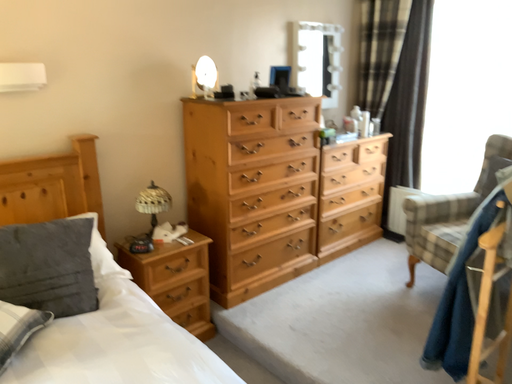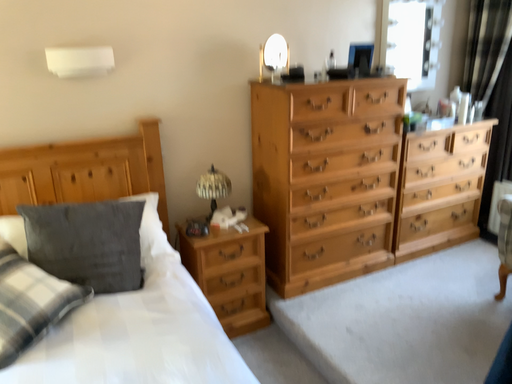
Question: How did the camera likely rotate when shooting the video?

Choices:
 (A) rotated right
 (B) rotated left

Answer: (B)